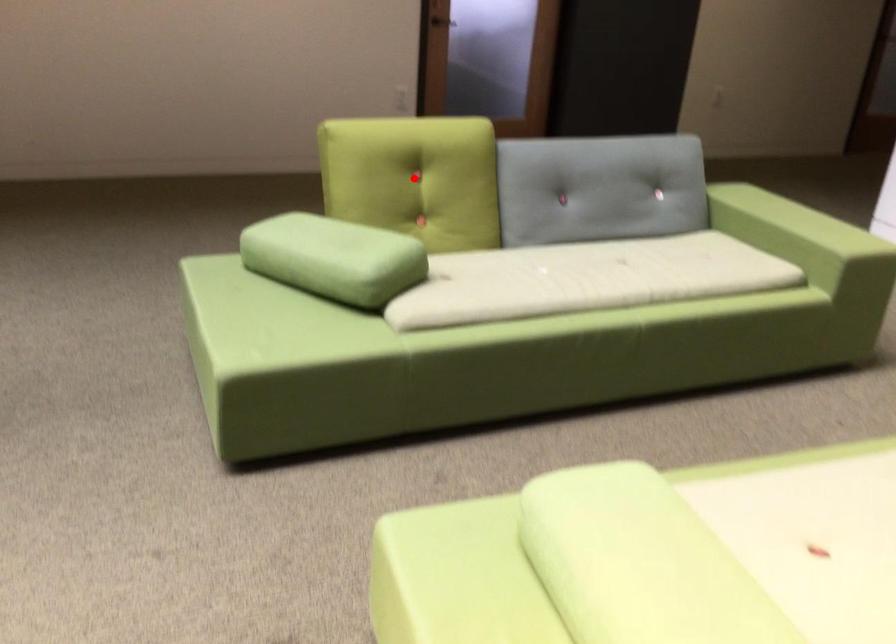
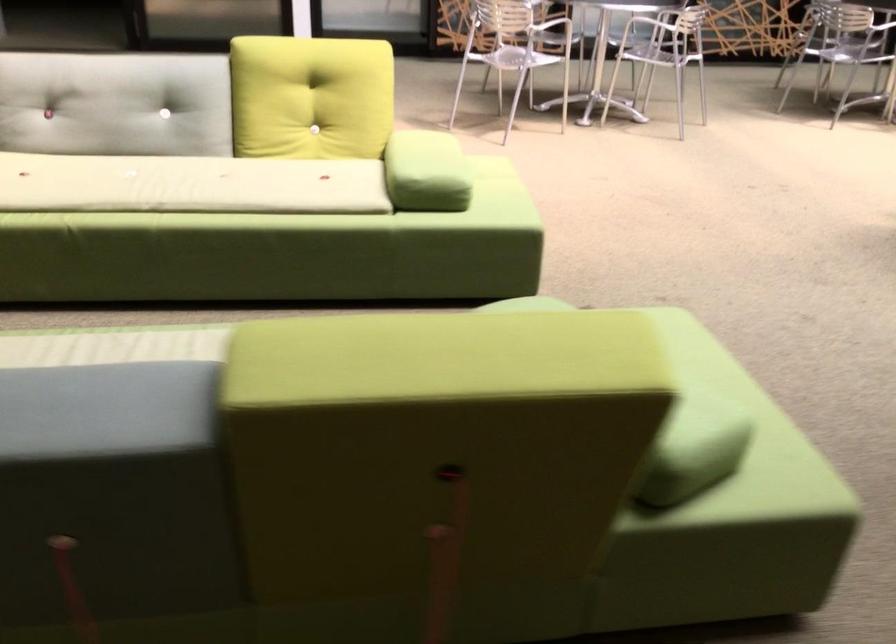
Question: I am providing you with two images of the same scene from different viewpoints. A red point is marked on the first image. Can you still see the location of the red point in image 2?

Choices:
 (A) Yes
 (B) No

Answer: (B)